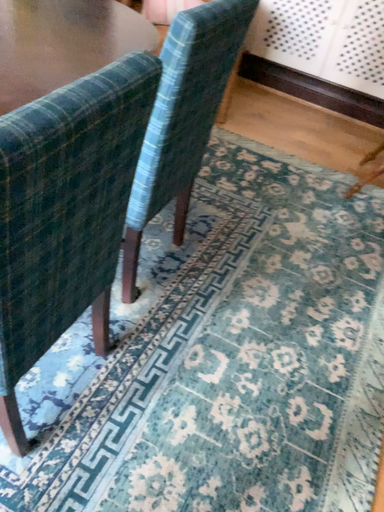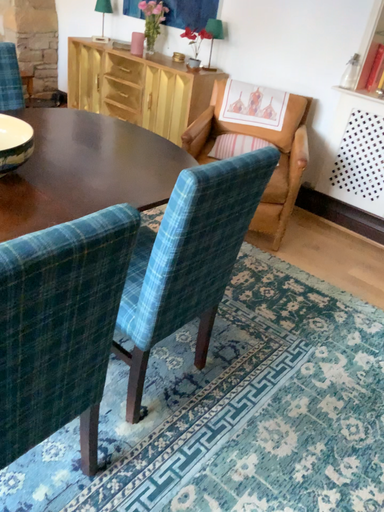
Question: Which way did the camera rotate in the video?

Choices:
 (A) rotated right
 (B) rotated left

Answer: (B)